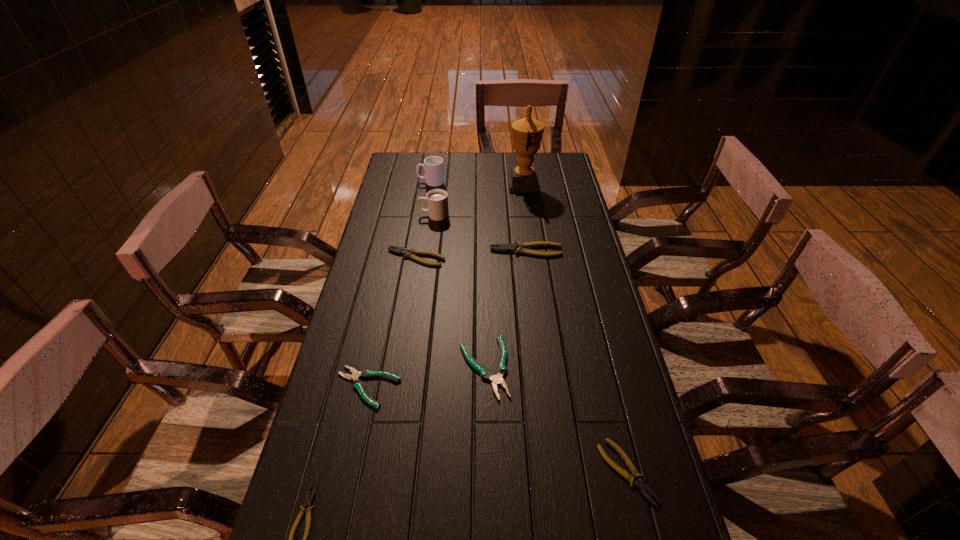
Image resolution: width=960 pixels, height=540 pixels. Identify the location of vacant space located 0.300m on the front of the bigger teal pliers. (486, 532).

At what (x,y) coordinates should I click in order to perform the action: click on vacant space located on the left of the second smallest yellow pliers. Please return your answer as a coordinate pair (x, y). Looking at the image, I should click on (548, 472).

You are a GUI agent. You are given a task and a screenshot of the screen. Output one action in this format:
    pyautogui.click(x=<x>, y=<y>)
    Task: Click on the vacant space located 0.130m on the back of the smaller teal pliers
    
    Given the screenshot: What is the action you would take?
    pyautogui.click(x=380, y=329)

Where is `award situated at the far edge`? This screenshot has width=960, height=540. award situated at the far edge is located at coordinates (527, 133).

This screenshot has height=540, width=960. Find the location of `cup located at the far edge`. cup located at the far edge is located at coordinates (434, 171).

I want to click on cup that is at the left edge, so click(x=434, y=171).

Identify the location of award situated at the right edge. This screenshot has height=540, width=960. (527, 133).

I want to click on object at the far left corner, so [x=434, y=171].

What are the coordinates of `object that is at the far right corner` in the screenshot? It's located at (527, 133).

In order to click on blank space at the far edge of the desktop in this screenshot , I will do `click(455, 160)`.